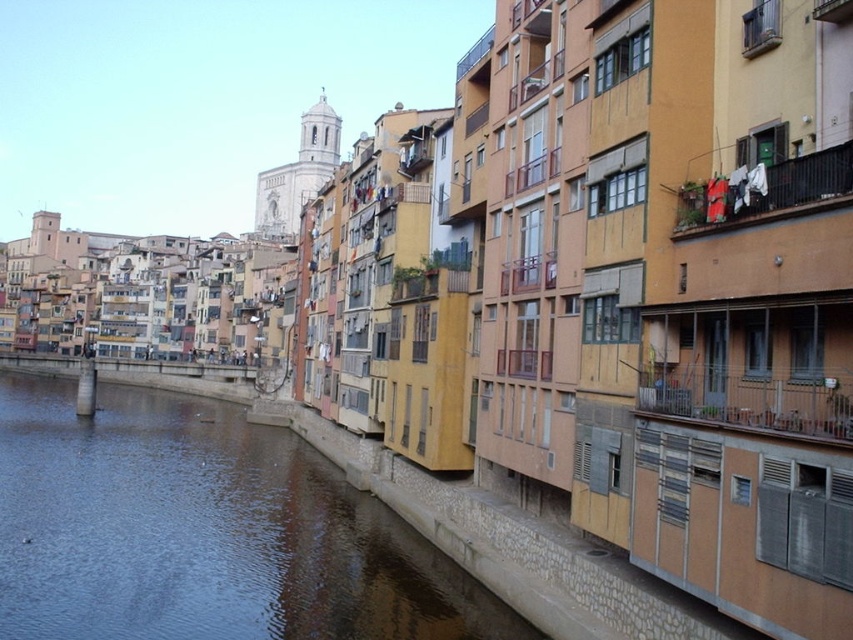
Question: Which point is closer to the camera?

Choices:
 (A) click(453, 579)
 (B) click(747, 168)

Answer: (B)

Question: Is blue water at lower left to the right of white fabric at upper right from the viewer's perspective?

Choices:
 (A) no
 (B) yes

Answer: (A)

Question: Which of the following is the closest to the observer?

Choices:
 (A) white fabric at upper right
 (B) blue water at lower left

Answer: (A)

Question: Is blue water at lower left below white fabric at upper right?

Choices:
 (A) no
 (B) yes

Answer: (B)

Question: Can you confirm if blue water at lower left is bigger than white fabric at upper right?

Choices:
 (A) yes
 (B) no

Answer: (A)

Question: Which of the following is the closest to the observer?

Choices:
 (A) (323, 492)
 (B) (737, 170)

Answer: (B)